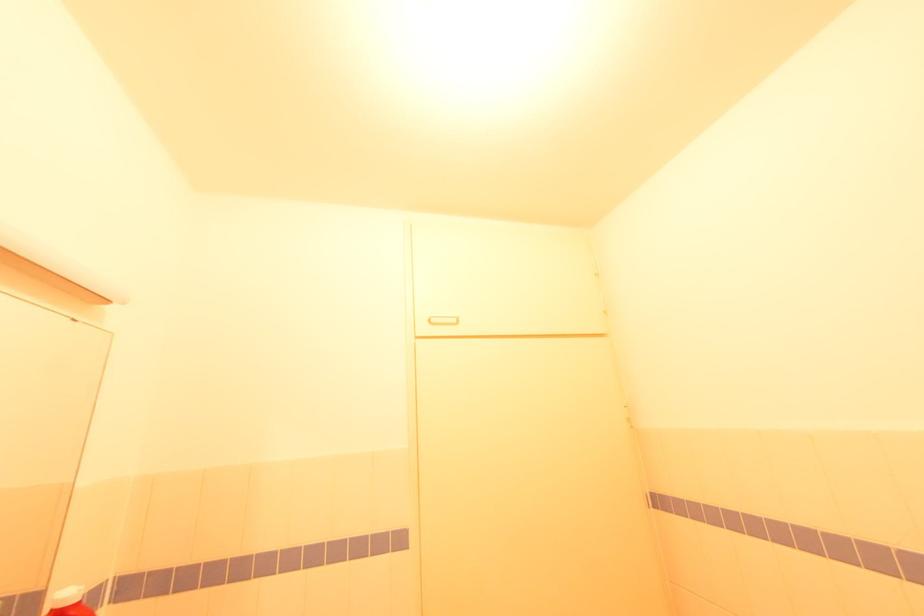
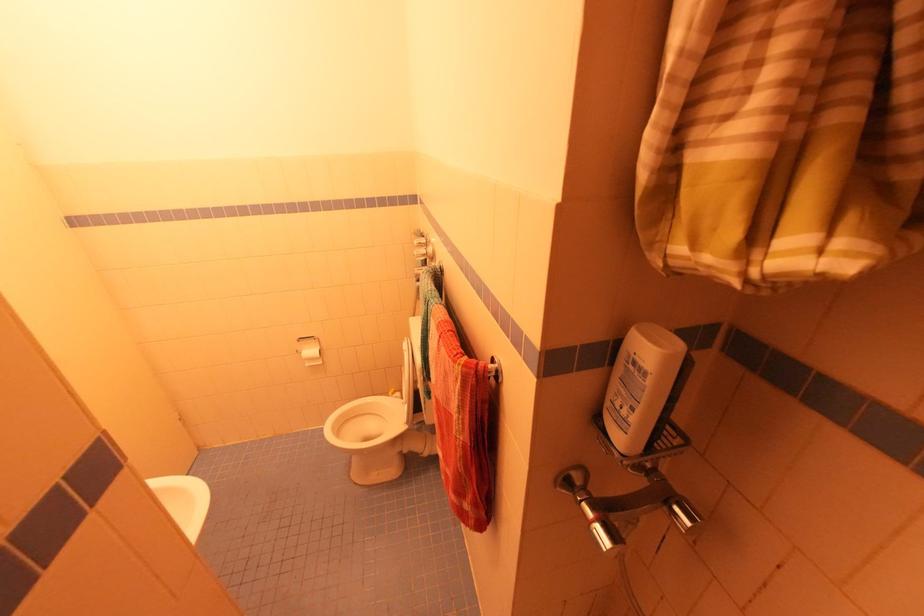
Based on the continuous images, in which direction is the camera rotating?

The rotation direction of the camera is right-down.